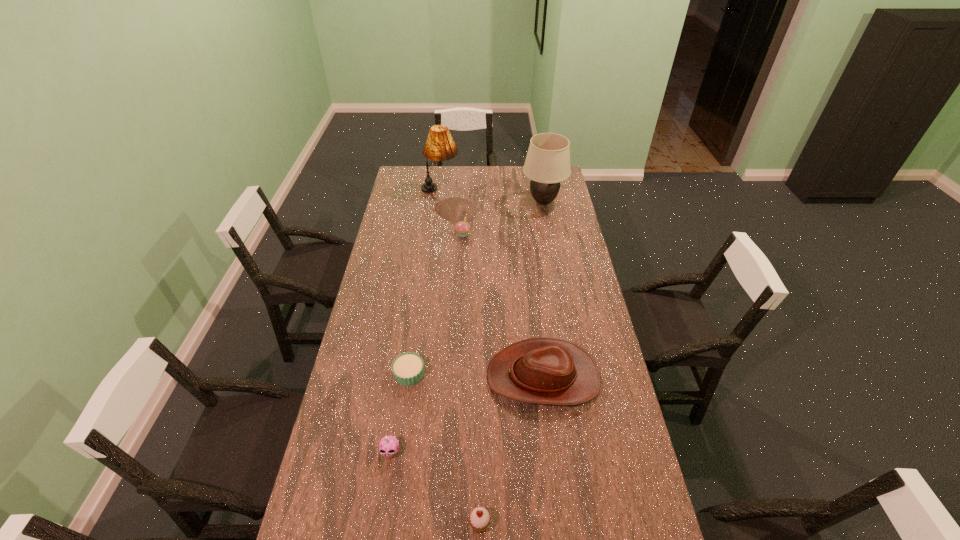
Locate an element on the screen. This screenshot has height=540, width=960. free spot between the nearest cupcake and the cowboy hat is located at coordinates (512, 451).

The height and width of the screenshot is (540, 960). In order to click on free space between the second cupcake from right to left and the cowboy hat in this screenshot , I will do `click(503, 306)`.

Locate an element on the screen. Image resolution: width=960 pixels, height=540 pixels. blank region between the right lampshade and the sixth farthest object is located at coordinates (467, 327).

The width and height of the screenshot is (960, 540). Find the location of `free point between the cowboy hat and the second cupcake from right to left`. free point between the cowboy hat and the second cupcake from right to left is located at coordinates (503, 306).

I want to click on vacant area that lies between the right lampshade and the sixth farthest object, so click(x=467, y=327).

Identify the location of vacant area between the farthest cupcake and the third nearest cupcake. (436, 305).

Image resolution: width=960 pixels, height=540 pixels. I want to click on vacant area between the cowboy hat and the third farthest cupcake, so click(x=467, y=415).

Identify the location of free spot between the shortest cupcake and the cowboy hat. This screenshot has height=540, width=960. (476, 376).

Image resolution: width=960 pixels, height=540 pixels. Find the location of `object that stands as the sixth closest to the second nearest cupcake`. object that stands as the sixth closest to the second nearest cupcake is located at coordinates (440, 146).

Locate an element on the screen. object that stands as the fourth closest to the left lampshade is located at coordinates (407, 368).